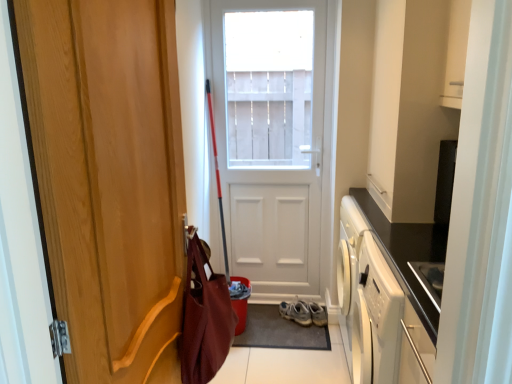
This screenshot has height=384, width=512. Identify the location of vacant space in dark gray rubber doormat at center (from a real-world perspective). (277, 324).